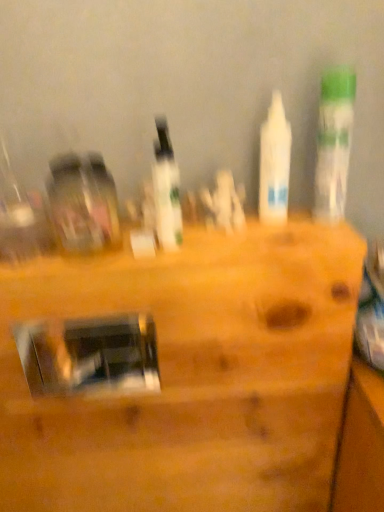
Question: From the image's perspective, is white matte bottle at center, which is the 2th bottle from right to left, above or below metallic silver mirror at center?

Choices:
 (A) above
 (B) below

Answer: (A)

Question: Considering the positions of white matte bottle at center, which is the 2th bottle from right to left, and metallic silver mirror at center in the image, is white matte bottle at center, which is the 2th bottle from right to left, taller or shorter than metallic silver mirror at center?

Choices:
 (A) tall
 (B) short

Answer: (B)

Question: Which object is the farthest from the white glossy bottle at upper right, the third bottle positioned from the left?

Choices:
 (A) metallic silver mirror at center
 (B) white glossy bottle at center, the first bottle in the left-to-right sequence
 (C) white matte bottle at center, which is the 2th bottle from right to left

Answer: (A)

Question: Which object is the closest to the white glossy bottle at upper right, the first bottle viewed from the right?

Choices:
 (A) white matte bottle at center, which is the 2th bottle from right to left
 (B) white glossy bottle at center, the first bottle in the left-to-right sequence
 (C) metallic silver mirror at center

Answer: (A)